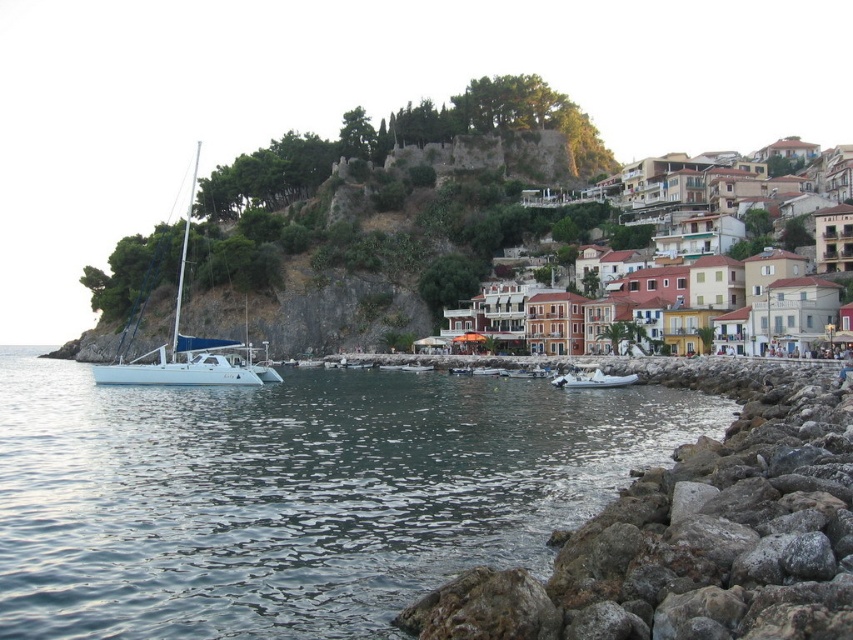
You are standing at the point with coordinates point [679,196] in the coastal scene. What do you see around you?

You see multicolored painted houses at center around you.

You are standing at the center of the image and want to walk towards the rockyrough stonerocky shore at lower right. Which direction should you face to head directly towards it?

To head directly towards the rockyrough stonerocky shore at lower right, you should face towards the lower right direction since it is located at point (694, 536) which is in the lower right area of the image.

You are a tourist standing on the rocky shoreline and want to take a photo of the multicolored painted houses at center and the white glossy sailboat at left. Which object should you point your camera towards first if you want to capture both in one frame?

The multicolored painted houses at center is located above the white glossy sailboat at left, so you should point your camera upwards to include both in the frame.